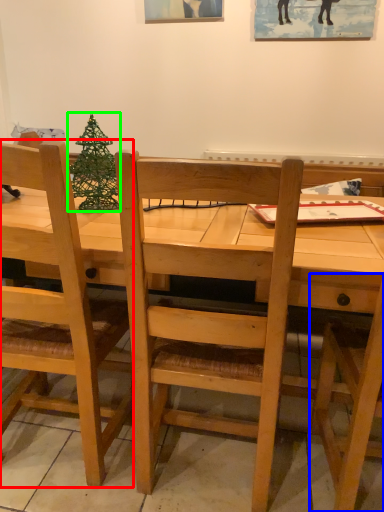
Question: Estimate the real-world distances between objects in this image. Which object is closer to chair (highlighted by a red box), chair (highlighted by a blue box) or christmas tree (highlighted by a green box)?

Choices:
 (A) chair
 (B) christmas tree

Answer: (B)